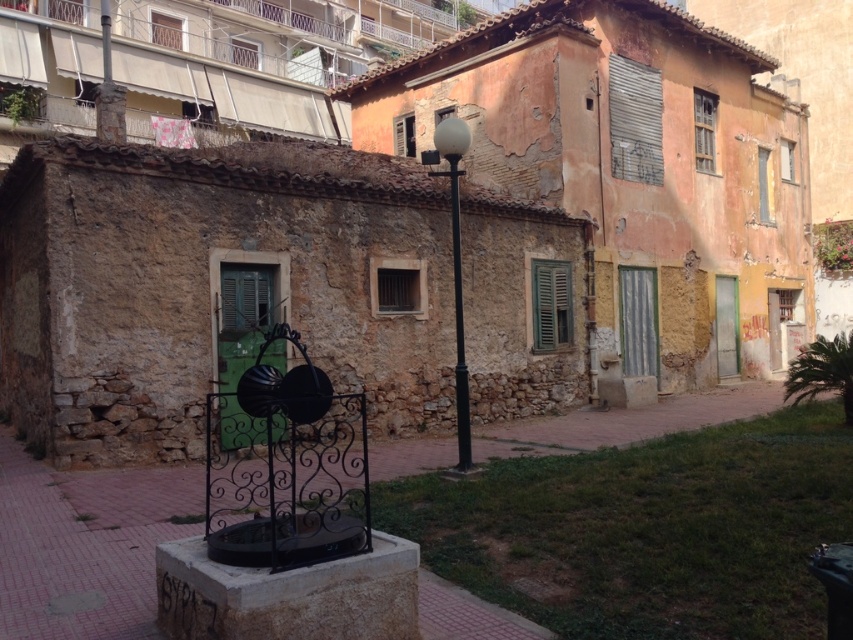
Does metallic silver shutter at right have a lesser height compared to wooden at upper right?

In fact, metallic silver shutter at right may be taller than wooden at upper right.

Is point (630, 305) in front of point (711, 115)?

Yes, point (630, 305) is in front of point (711, 115).

At what (x,y) coordinates should I click in order to perform the action: click on metallic silver shutter at right. Please return your answer as a coordinate pair (x, y). Looking at the image, I should click on (637, 321).

Can you confirm if metallic silver shutter at right is shorter than green wooden shutter at upper center?

Incorrect, metallic silver shutter at right's height does not fall short of green wooden shutter at upper center's.

The width and height of the screenshot is (853, 640). I want to click on metallic silver shutter at right, so click(x=637, y=321).

Find the location of a particular element. The height and width of the screenshot is (640, 853). metallic silver shutter at right is located at coordinates (637, 321).

At what (x,y) coordinates should I click in order to perform the action: click on metallic silver shutter at upper right. Please return your answer as a coordinate pair (x, y). The width and height of the screenshot is (853, 640). Looking at the image, I should click on (635, 120).

Can you confirm if metallic silver shutter at upper right is bigger than black metal lamp post at center?

Incorrect, metallic silver shutter at upper right is not larger than black metal lamp post at center.

Which is behind, point (628, 65) or point (466, 412)?

The point (628, 65) is behind.

Find the location of a particular element. This screenshot has height=640, width=853. metallic silver shutter at upper right is located at coordinates (635, 120).